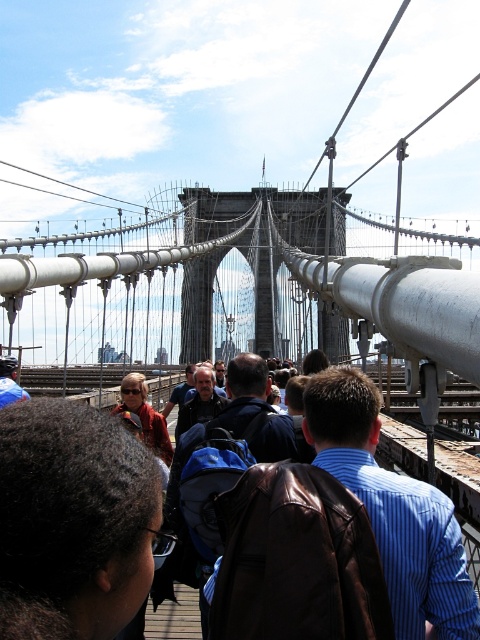
Question: Considering the real-world distances, which object is closest to the brown leather jacket at center?

Choices:
 (A) dark brown hair at center
 (B) matte brown leather jacket at center

Answer: (A)

Question: Is dark brown hair at center positioned before brown leather jacket at center?

Choices:
 (A) yes
 (B) no

Answer: (A)

Question: Which is farther from the dark brown hair at center?

Choices:
 (A) matte brown leather jacket at center
 (B) brown leather jacket at center

Answer: (A)

Question: Does brown leather jacket at center have a lesser width compared to matte brown leather jacket at center?

Choices:
 (A) yes
 (B) no

Answer: (B)

Question: Does brown leather jacket at center have a lesser width compared to matte brown leather jacket at center?

Choices:
 (A) no
 (B) yes

Answer: (A)

Question: Which object is positioned farthest from the dark brown hair at center?

Choices:
 (A) brown leather jacket at center
 (B) matte brown leather jacket at center

Answer: (B)